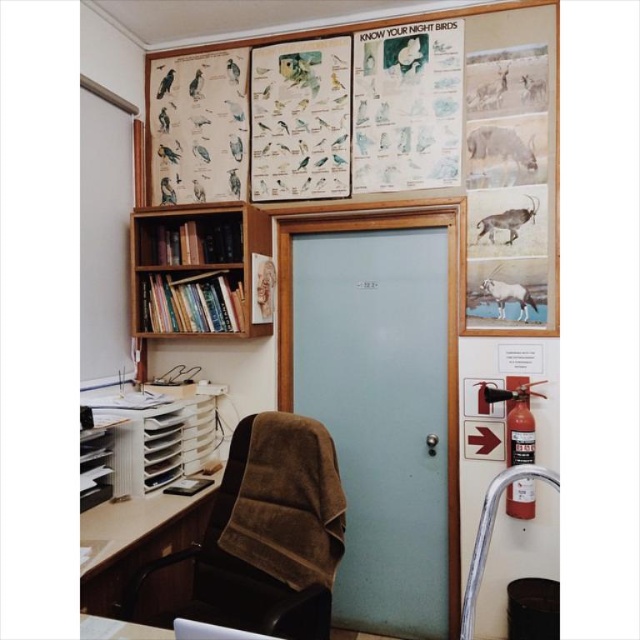
Question: Estimate the real-world distances between objects in this image. Which object is closer to the white glossy table at lower left?

Choices:
 (A) white glossy antelope at right
 (B) white textured antelope at upper right

Answer: (A)

Question: Which point is closer to the camera?

Choices:
 (A) (192, 573)
 (B) (176, 289)

Answer: (A)

Question: Is white textured antelope at upper right to the left of white glossy table at lower left from the viewer's perspective?

Choices:
 (A) no
 (B) yes

Answer: (A)

Question: Can you confirm if brown fabric swivel chair at lower left is positioned above light brown wood desk at lower left?

Choices:
 (A) yes
 (B) no

Answer: (B)

Question: Which point is closer to the camera?

Choices:
 (A) (516, 208)
 (B) (499, 289)
 (C) (176, 534)
 (D) (192, 289)

Answer: (C)

Question: Can you confirm if frosted glass door at center is thinner than brown glossy antelope at right?

Choices:
 (A) no
 (B) yes

Answer: (A)